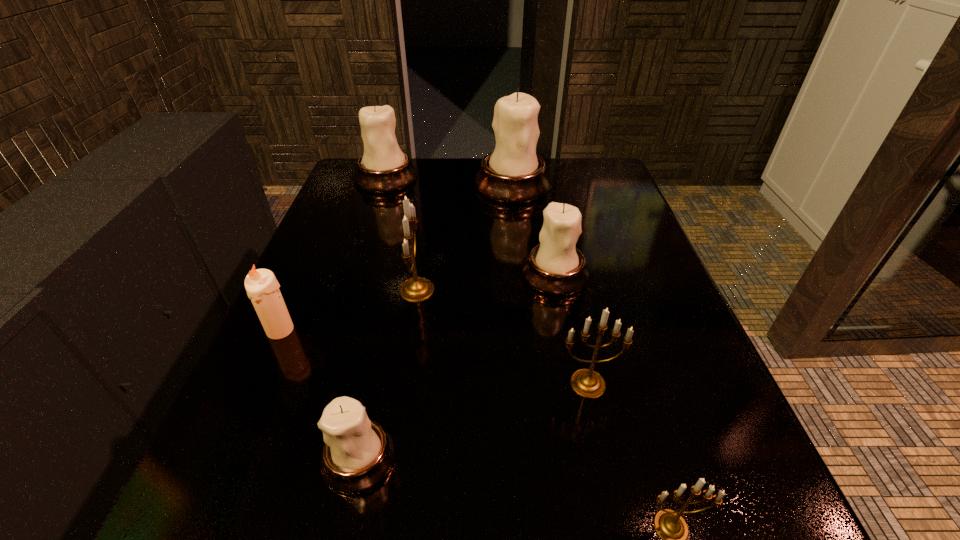
You are a GUI agent. You are given a task and a screenshot of the screen. Output one action in this format:
    pyautogui.click(x=<x>, y=<y>)
    Task: Click on the vacant space that's between the second nearest white candle holder and the biggest gold candelabrum
    
    Given the screenshot: What is the action you would take?
    pyautogui.click(x=486, y=282)

Locate an element on the screen. free space between the sixth farthest candelabrum and the second nearest white candle holder is located at coordinates (457, 366).

The image size is (960, 540). Find the location of `free space between the smallest white candle holder and the second biggest gold candelabrum`. free space between the smallest white candle holder and the second biggest gold candelabrum is located at coordinates (473, 421).

You are a GUI agent. You are given a task and a screenshot of the screen. Output one action in this format:
    pyautogui.click(x=<x>, y=<y>)
    Task: Click on the object that is the sixth closest to the biggest gold candelabrum
    
    Given the screenshot: What is the action you would take?
    pyautogui.click(x=383, y=168)

The height and width of the screenshot is (540, 960). Find the location of `the seventh closest object to the biggest gold candelabrum`. the seventh closest object to the biggest gold candelabrum is located at coordinates (669, 524).

Identify which candelabrum is the closest to the third biggest white candle holder. Please provide its 2D coordinates. Your answer should be formatted as a tuple, i.e. [(x, y)], where the tuple contains the x and y coordinates of a point satisfying the conditions above.

[(585, 382)]

Choose which candelabrum is the second nearest neighbor to the farthest gold candelabrum. Please provide its 2D coordinates. Your answer should be formatted as a tuple, i.e. [(x, y)], where the tuple contains the x and y coordinates of a point satisfying the conditions above.

[(358, 453)]

Select which white candle holder appears as the third closest to the third smallest white candle holder. Please provide its 2D coordinates. Your answer should be formatted as a tuple, i.e. [(x, y)], where the tuple contains the x and y coordinates of a point satisfying the conditions above.

[(358, 453)]

Identify which white candle holder is located as the second nearest to the nearest object. Please provide its 2D coordinates. Your answer should be formatted as a tuple, i.e. [(x, y)], where the tuple contains the x and y coordinates of a point satisfying the conditions above.

[(556, 267)]

I want to click on the second closest gold candelabrum to the smallest gold candelabrum, so click(416, 289).